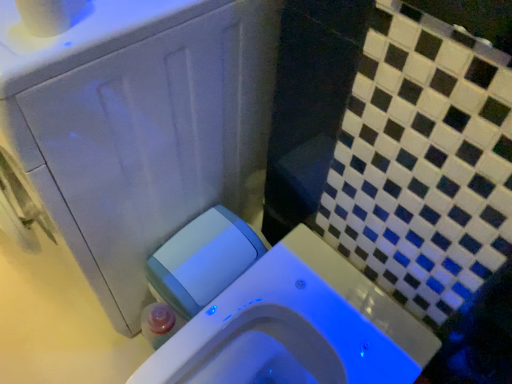
Question: From the image's perspective, is white matte toilet paper at upper left located above or below white glossy toilet at center?

Choices:
 (A) above
 (B) below

Answer: (A)

Question: Considering their positions, is white matte toilet paper at upper left located in front of or behind white glossy toilet at center?

Choices:
 (A) behind
 (B) front

Answer: (B)

Question: Which object is positioned farthest from the white plastic water tank at lower left?

Choices:
 (A) white glossy toilet at center
 (B) white matte toilet paper at upper left

Answer: (B)

Question: Which object is positioned farthest from the white plastic water tank at lower left?

Choices:
 (A) white glossy toilet at center
 (B) white matte toilet paper at upper left

Answer: (B)